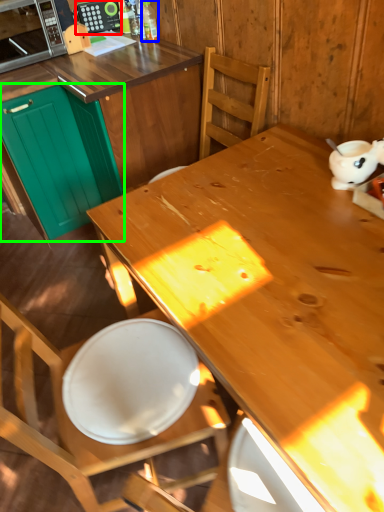
Question: Considering the real-world distances, which object is farthest from appliance (highlighted by a red box)? bottle (highlighted by a blue box) or cabinetry (highlighted by a green box)?

Choices:
 (A) bottle
 (B) cabinetry

Answer: (B)